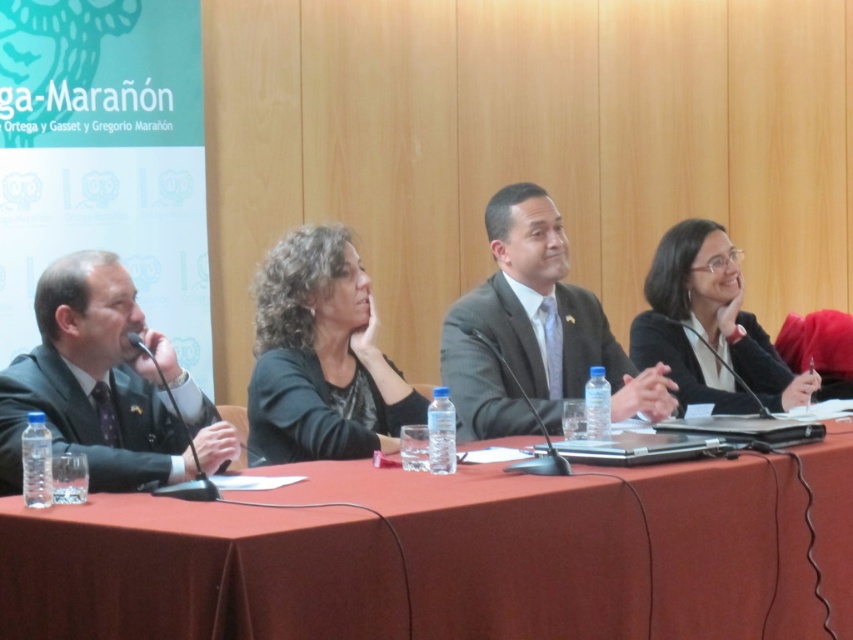
Who is shorter, matte black suit at left or black glossy blazer at right?

Standing shorter between the two is matte black suit at left.

Between point (134, 348) and point (670, 372), which one is positioned behind?

Positioned behind is point (670, 372).

Identify the location of matte black suit at left. (106, 385).

You are a GUI agent. You are given a task and a screenshot of the screen. Output one action in this format:
    pyautogui.click(x=<x>, y=<y>)
    Task: Click on the matte black suit at left
    The height and width of the screenshot is (640, 853).
    Given the screenshot: What is the action you would take?
    pyautogui.click(x=106, y=385)

Does matte black suit at left lie behind black matte blazer at center?

That is False.

Find the location of `matte black suit at left`. matte black suit at left is located at coordinates (106, 385).

Find the location of a particular element. The height and width of the screenshot is (640, 853). matte black suit at left is located at coordinates (106, 385).

Between smooth red tablecloth at center and gray suit at center, which one is positioned higher?

gray suit at center is above.

Measure the distance between smooth red tablecloth at center and camera.

A distance of 5.93 feet exists between smooth red tablecloth at center and camera.

Between point (746, 612) and point (491, 364), which one is positioned in front?

Positioned in front is point (746, 612).

Identify the location of smooth red tablecloth at center. This screenshot has width=853, height=640. (196, 572).